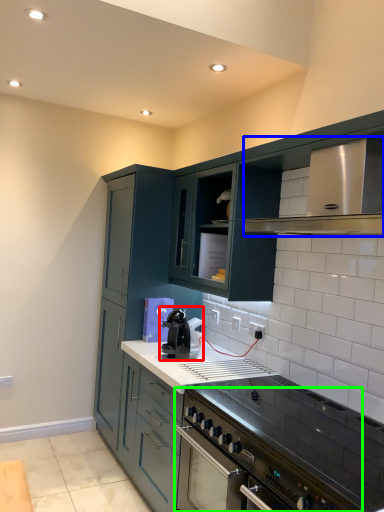
Question: Which is nearer to the home appliance (highlighted by a red box)? vent (highlighted by a blue box) or kitchen appliance (highlighted by a green box).

Choices:
 (A) vent
 (B) kitchen appliance

Answer: (B)